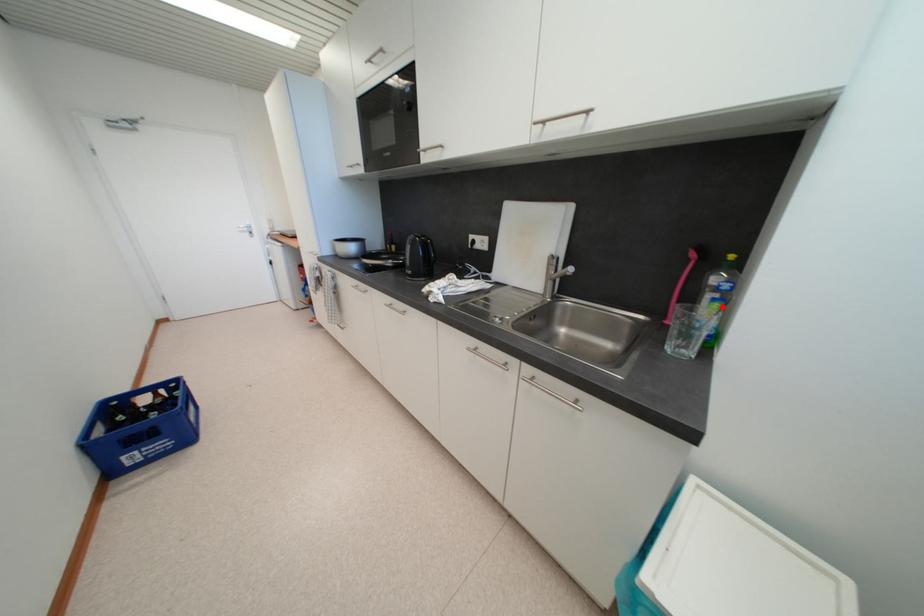
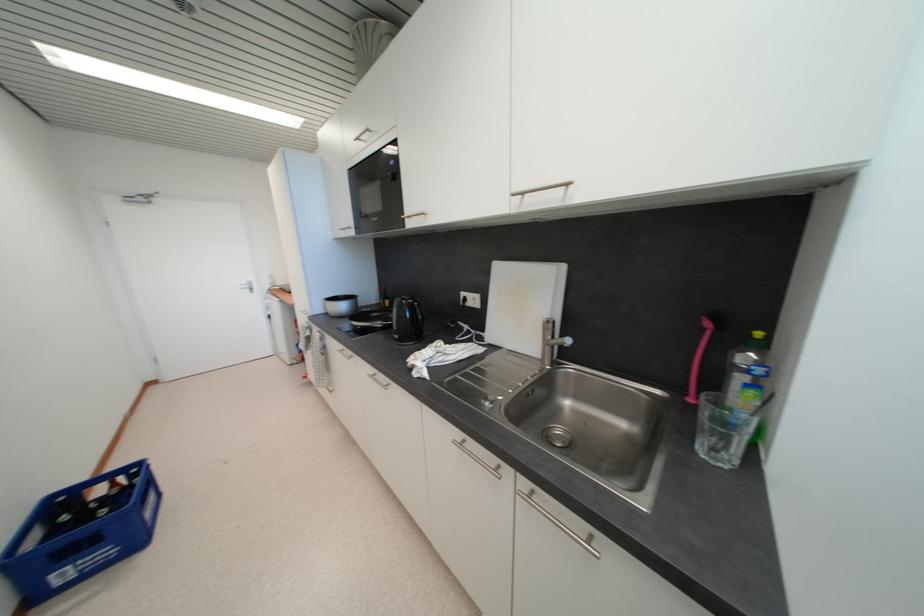
Question: I am providing you with two images of the same scene from different viewpoints. A red point is marked on the first image. At the location where the point appears in image 1, is it still visible in image 2?

Choices:
 (A) Yes
 (B) No

Answer: (A)